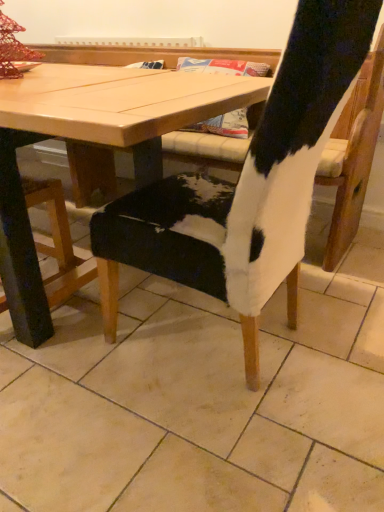
Question: Is cowhide chair at center with wooden table at center?

Choices:
 (A) no
 (B) yes

Answer: (A)

Question: Can you confirm if cowhide chair at center is positioned to the left of wooden table at center?

Choices:
 (A) no
 (B) yes

Answer: (A)

Question: Is cowhide chair at center far from wooden table at center?

Choices:
 (A) no
 (B) yes

Answer: (A)

Question: Can you confirm if cowhide chair at center is bigger than wooden table at center?

Choices:
 (A) no
 (B) yes

Answer: (A)

Question: Is cowhide chair at center surrounding wooden table at center?

Choices:
 (A) no
 (B) yes

Answer: (A)

Question: Considering the relative sizes of cowhide chair at center and wooden table at center in the image provided, is cowhide chair at center wider than wooden table at center?

Choices:
 (A) no
 (B) yes

Answer: (B)

Question: Can you confirm if cowhide chair at center is positioned to the left of cowhide chair at center?

Choices:
 (A) no
 (B) yes

Answer: (B)

Question: From the image's perspective, does cowhide chair at center appear lower than cowhide chair at center?

Choices:
 (A) yes
 (B) no

Answer: (B)

Question: Is cowhide chair at center closer to the viewer compared to cowhide chair at center?

Choices:
 (A) yes
 (B) no

Answer: (B)

Question: Is cowhide chair at center inside cowhide chair at center?

Choices:
 (A) yes
 (B) no

Answer: (B)

Question: Does cowhide chair at center have a smaller size compared to cowhide chair at center?

Choices:
 (A) yes
 (B) no

Answer: (B)

Question: Is cowhide chair at center facing towards cowhide chair at center?

Choices:
 (A) yes
 (B) no

Answer: (B)

Question: Is there a large distance between wooden table at center and cowhide chair at center?

Choices:
 (A) yes
 (B) no

Answer: (B)